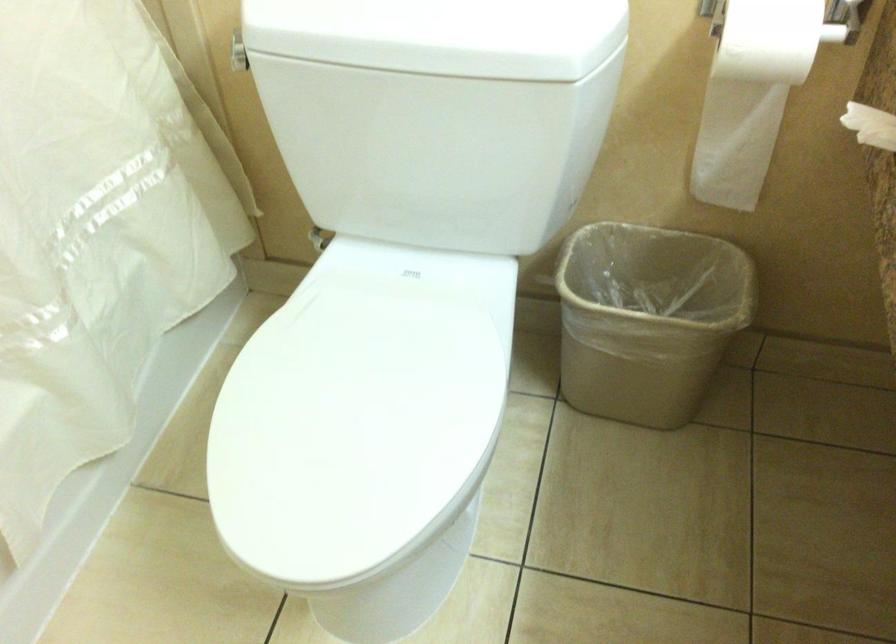
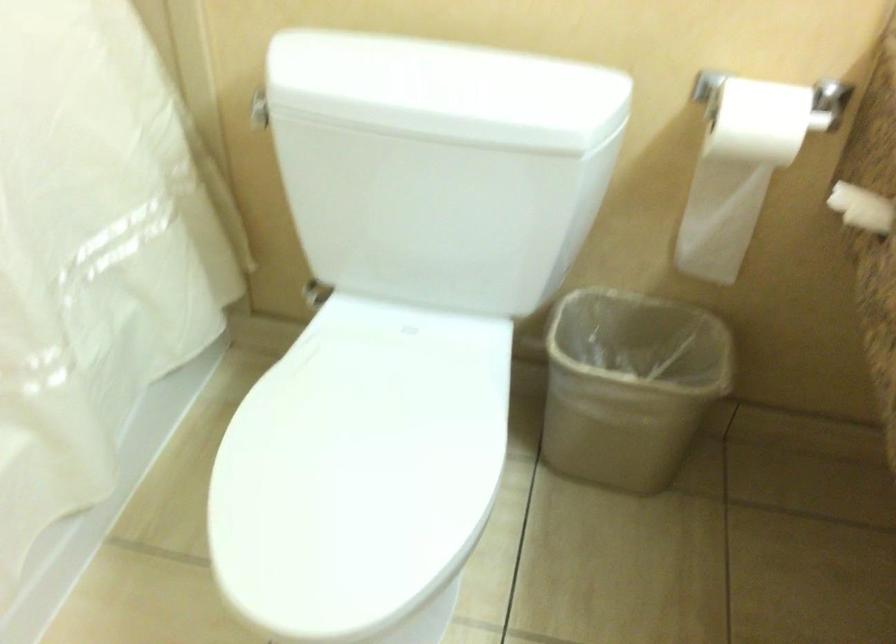
Question: How did the camera likely rotate?

Choices:
 (A) Left
 (B) Right
 (C) Up
 (D) Down

Answer: (C)